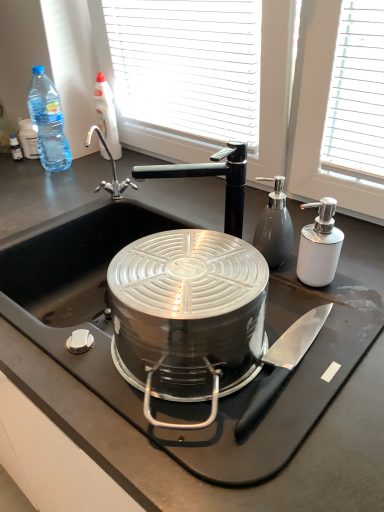
At what (x,y) coordinates should I click in order to perform the action: click on vacant area on the back side of black matte faucet at upper center. Please return your answer as a coordinate pair (x, y). The height and width of the screenshot is (512, 384). Looking at the image, I should click on (181, 206).